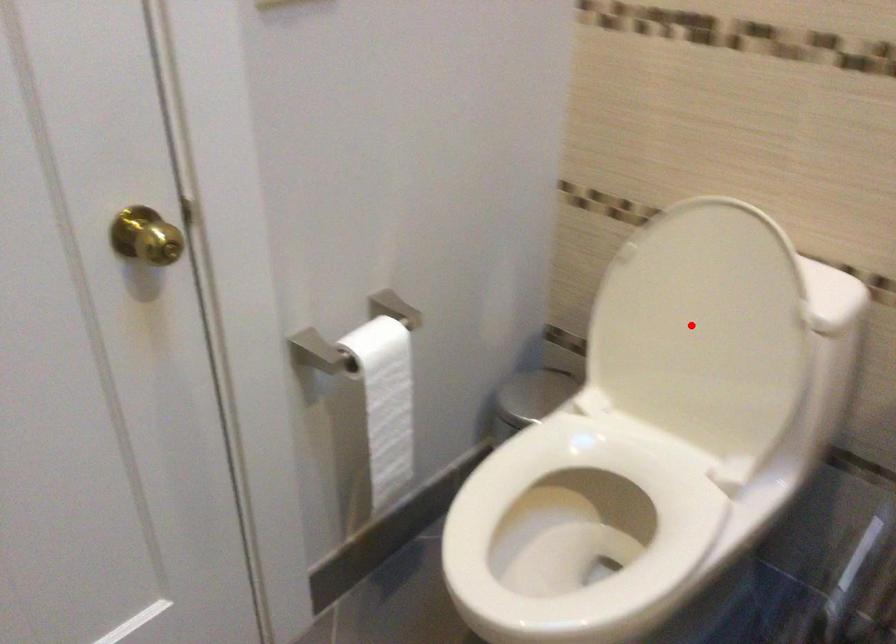
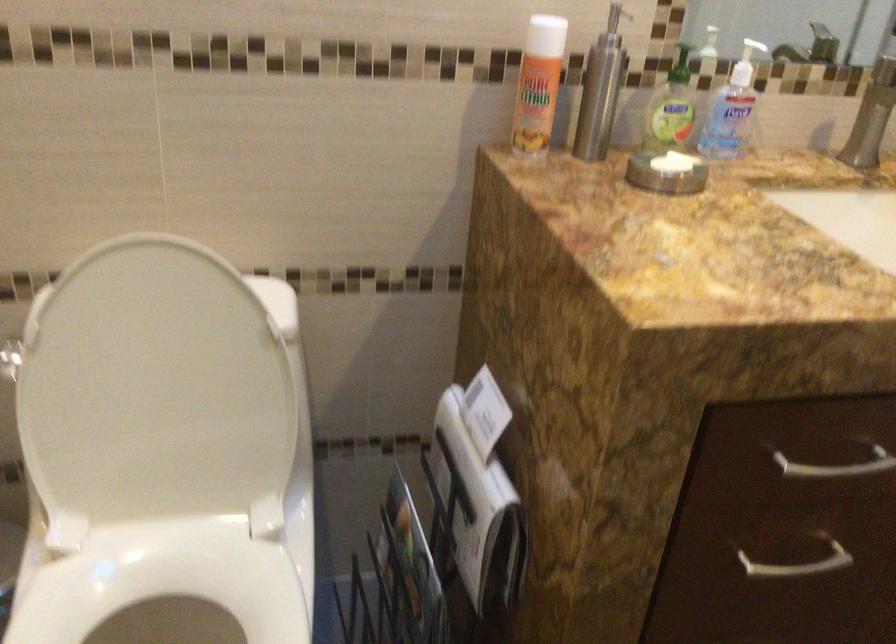
The point at the highlighted location is marked in the first image. Where is the corresponding point in the second image?

(152, 391)